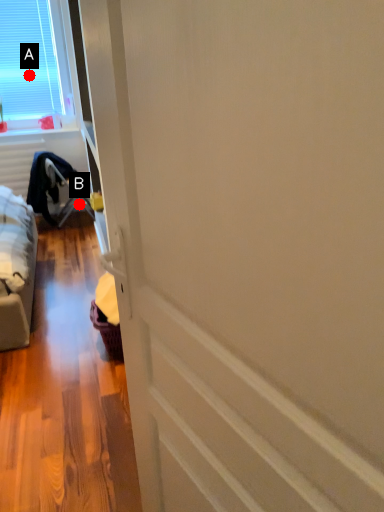
Question: Two points are circled on the image, labeled by A and B beside each circle. Which point is closer to the camera?

Choices:
 (A) A is closer
 (B) B is closer

Answer: (A)